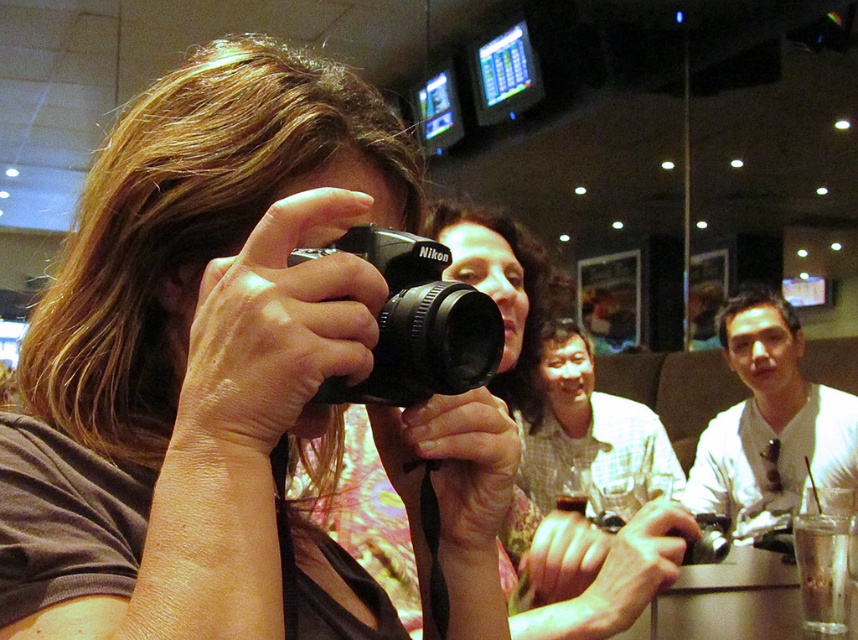
Question: Is floral fabric shirt at center wider than white shirt at center?

Choices:
 (A) no
 (B) yes

Answer: (A)

Question: Which is nearer to the black matte nikon camera at center?

Choices:
 (A) floral fabric shirt at center
 (B) white shirt at center

Answer: (A)

Question: Considering the real-world distances, which object is closest to the white shirt at center?

Choices:
 (A) floral fabric shirt at center
 (B) black matte nikon camera at center

Answer: (A)

Question: Is the position of white shirt at center less distant than that of black matte nikon camera at center?

Choices:
 (A) yes
 (B) no

Answer: (B)

Question: Which of the following is the farthest from the observer?

Choices:
 (A) (417, 266)
 (B) (783, 481)

Answer: (B)

Question: Is white shirt at center to the left of black matte nikon camera at center from the viewer's perspective?

Choices:
 (A) no
 (B) yes

Answer: (A)